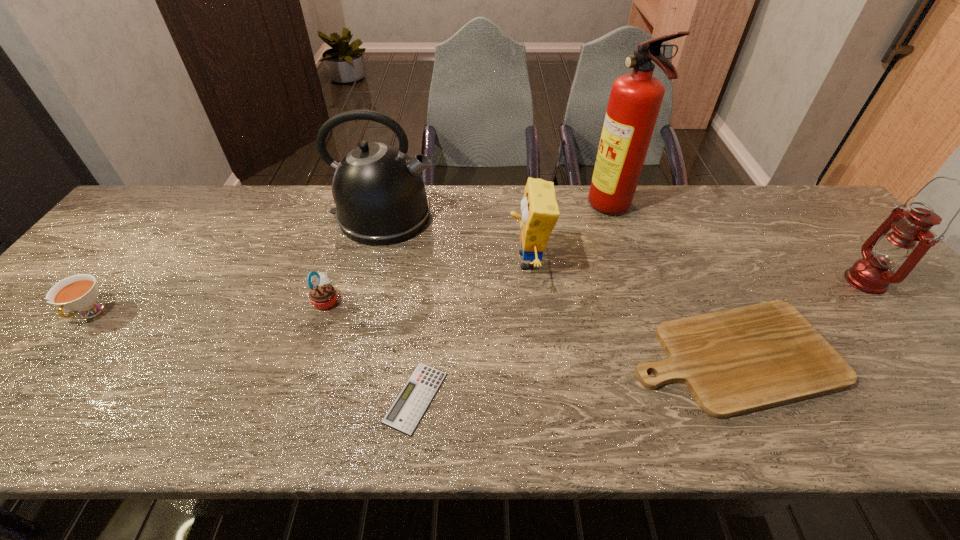
The height and width of the screenshot is (540, 960). What are the coordinates of `free space that satisfies the following two spatial constraints: 1. on the front-facing side of the chopping board; 2. on the left side of the fourth shortest object` in the screenshot? It's located at (308, 356).

Identify the location of vacant point that satisfies the following two spatial constraints: 1. on the spout of the chopping board; 2. on the left side of the kettle. The height and width of the screenshot is (540, 960). (350, 356).

Where is `free space that satisfies the following two spatial constraints: 1. on the front-facing side of the fifth tallest object; 2. on the left side of the shortest object`? free space that satisfies the following two spatial constraints: 1. on the front-facing side of the fifth tallest object; 2. on the left side of the shortest object is located at coordinates (295, 397).

Where is `vacant area that satisfies the following two spatial constraints: 1. on the back side of the shortest object; 2. on the front-facing side of the fourth shortest object`? vacant area that satisfies the following two spatial constraints: 1. on the back side of the shortest object; 2. on the front-facing side of the fourth shortest object is located at coordinates (426, 300).

The height and width of the screenshot is (540, 960). In order to click on free point that satisfies the following two spatial constraints: 1. on the face of the fifth object from left to right; 2. on the side of the sixth tallest object with the handle in this screenshot , I will do `click(534, 313)`.

Where is `vacant region that satisfies the following two spatial constraints: 1. on the spout of the kettle; 2. on the side of the leftmost object with the handle`? vacant region that satisfies the following two spatial constraints: 1. on the spout of the kettle; 2. on the side of the leftmost object with the handle is located at coordinates (361, 313).

Where is `free location that satisfies the following two spatial constraints: 1. on the front-facing side of the fire extinguisher; 2. on the side of the leftmost object with the handle`? free location that satisfies the following two spatial constraints: 1. on the front-facing side of the fire extinguisher; 2. on the side of the leftmost object with the handle is located at coordinates (647, 313).